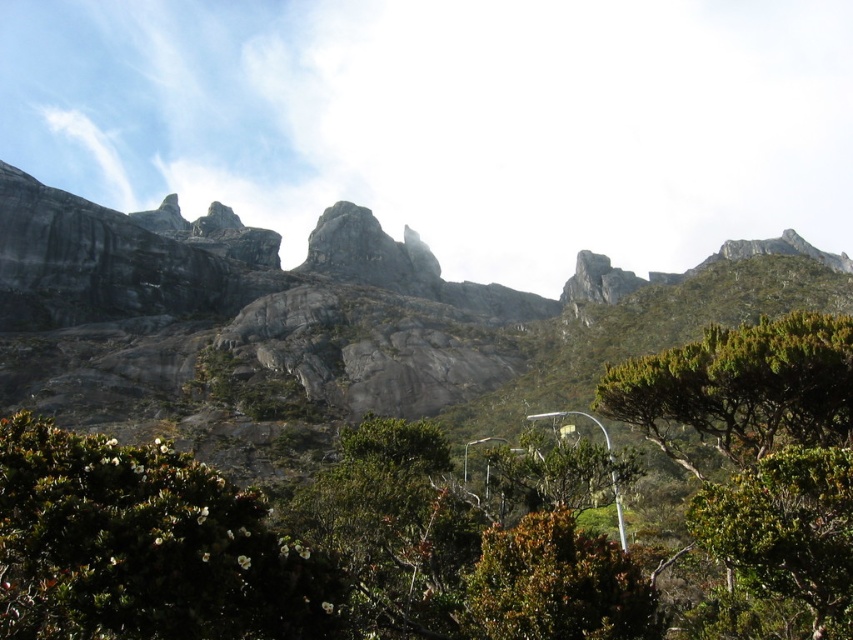
Question: Is green leafy tree at lower right positioned before green leafy bush at lower center?

Choices:
 (A) yes
 (B) no

Answer: (A)

Question: Is green leafy shrub at center smaller than green leafy tree at center?

Choices:
 (A) yes
 (B) no

Answer: (B)

Question: Does gray rock mountain at center appear on the right side of green leafy tree at center?

Choices:
 (A) yes
 (B) no

Answer: (A)

Question: Estimate the real-world distances between objects in this image. Which object is closer to the green leafy tree at center?

Choices:
 (A) green leafy shrub at center
 (B) green leafy tree at lower right

Answer: (A)

Question: Among these objects, which one is nearest to the camera?

Choices:
 (A) green leafy shrub at lower right
 (B) green leafy bush at lower center
 (C) gray rock mountain at center

Answer: (B)

Question: Based on their relative distances, which object is nearer to the green leafy tree at lower right?

Choices:
 (A) green leafy shrub at center
 (B) green leafy bush at lower center

Answer: (B)